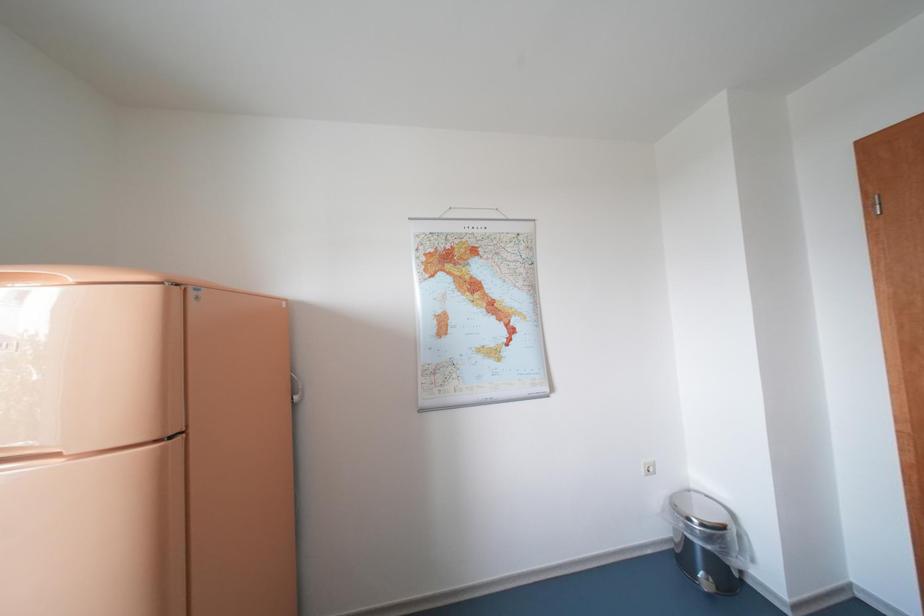
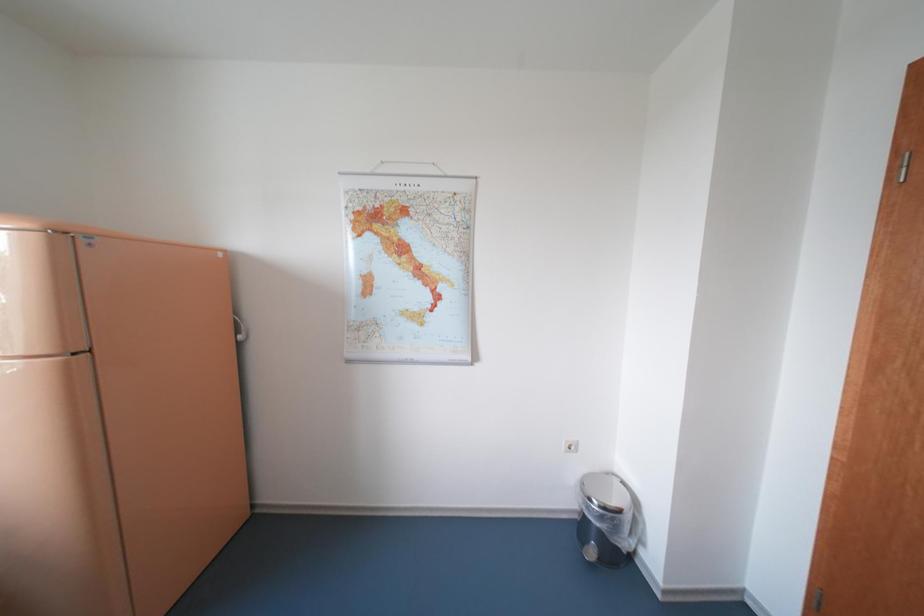
Question: Based on the continuous images, in which direction is the camera rotating? Reply with the corresponding letter.

Choices:
 (A) Left
 (B) Right
 (C) Up
 (D) Down

Answer: (D)